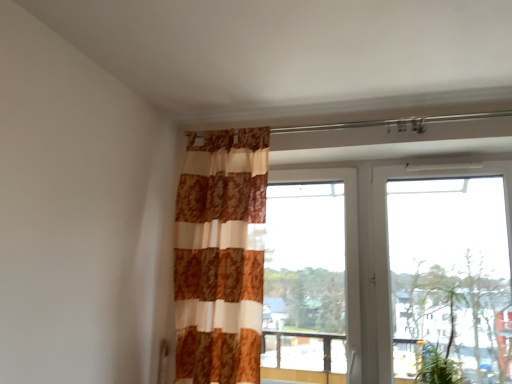
Question: Is patterned fabric curtain at center shorter than white plastic window at upper right, the 2th window when ordered from left to right?

Choices:
 (A) yes
 (B) no

Answer: (B)

Question: Is the depth of patterned fabric curtain at center greater than that of white plastic window at upper right, the 2th window when ordered from left to right?

Choices:
 (A) yes
 (B) no

Answer: (A)

Question: Is patterned fabric curtain at center in front of white plastic window at upper right, the 1th window viewed from the right?

Choices:
 (A) no
 (B) yes

Answer: (A)

Question: Is patterned fabric curtain at center not near white plastic window at upper right, the 1th window viewed from the right?

Choices:
 (A) no
 (B) yes

Answer: (A)

Question: Considering the relative positions of patterned fabric curtain at center and white plastic window at upper right, the 1th window viewed from the right, in the image provided, is patterned fabric curtain at center to the right of white plastic window at upper right, the 1th window viewed from the right, from the viewer's perspective?

Choices:
 (A) yes
 (B) no

Answer: (B)

Question: Considering the relative sizes of patterned fabric curtain at center and white plastic window at upper right, the 2th window when ordered from left to right, in the image provided, is patterned fabric curtain at center bigger than white plastic window at upper right, the 2th window when ordered from left to right,?

Choices:
 (A) yes
 (B) no

Answer: (B)

Question: Is the surface of green leafy plant at lower right in direct contact with patterned fabric curtain at center?

Choices:
 (A) no
 (B) yes

Answer: (A)

Question: Considering the relative sizes of green leafy plant at lower right and patterned fabric curtain at center in the image provided, is green leafy plant at lower right thinner than patterned fabric curtain at center?

Choices:
 (A) no
 (B) yes

Answer: (B)

Question: Is patterned fabric curtain at center a part of green leafy plant at lower right?

Choices:
 (A) no
 (B) yes

Answer: (A)

Question: From the image's perspective, does green leafy plant at lower right appear higher than patterned fabric curtain at center?

Choices:
 (A) yes
 (B) no

Answer: (B)

Question: From a real-world perspective, is green leafy plant at lower right located higher than patterned fabric curtain at center?

Choices:
 (A) no
 (B) yes

Answer: (A)

Question: Are green leafy plant at lower right and patterned fabric curtain at center located far from each other?

Choices:
 (A) yes
 (B) no

Answer: (A)

Question: From the image's perspective, is green leafy plant at lower right below white plastic window at upper right, the 1th window viewed from the right?

Choices:
 (A) no
 (B) yes

Answer: (B)